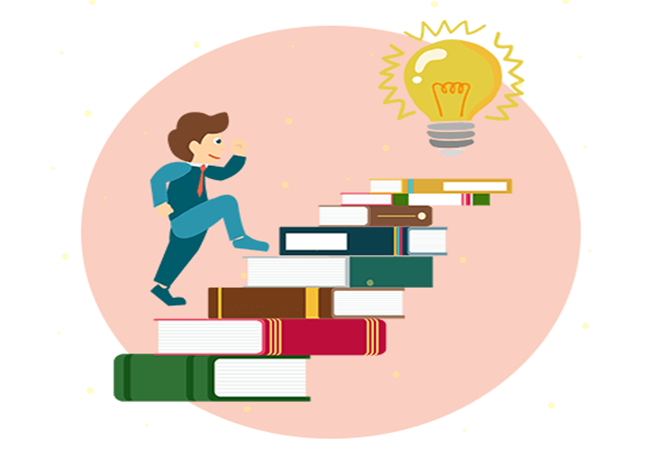
Locate an element on the screen. The height and width of the screenshot is (450, 650). books is located at coordinates (175, 370), (305, 337), (275, 309), (392, 272), (372, 239), (393, 214), (433, 201), (478, 183).